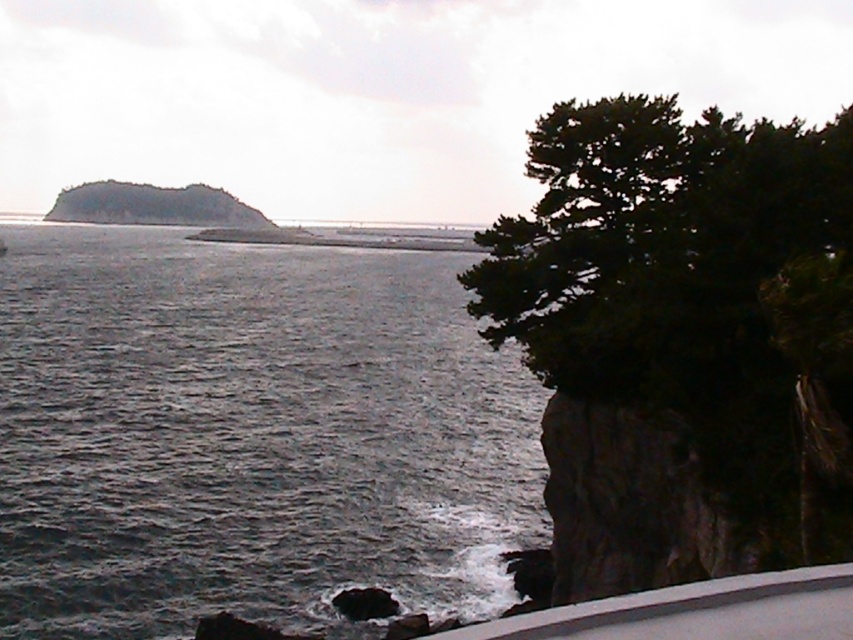
Question: Which object is the farthest from the dark gray water at center?

Choices:
 (A) dark gray rocky island at upper left
 (B) dark green leafy tree at right

Answer: (A)

Question: Can you confirm if dark gray water at center is positioned to the left of dark gray rocky island at upper left?

Choices:
 (A) no
 (B) yes

Answer: (A)

Question: Is dark gray water at center smaller than dark green leafy tree at right?

Choices:
 (A) yes
 (B) no

Answer: (B)

Question: Estimate the real-world distances between objects in this image. Which object is closer to the dark gray water at center?

Choices:
 (A) dark gray rocky island at upper left
 (B) dark green leafy tree at right

Answer: (B)

Question: Which of the following is the closest to the observer?

Choices:
 (A) (456, 554)
 (B) (234, 220)
 (C) (761, 417)

Answer: (C)

Question: Is dark green leafy tree at right further to camera compared to dark gray rocky island at upper left?

Choices:
 (A) yes
 (B) no

Answer: (B)